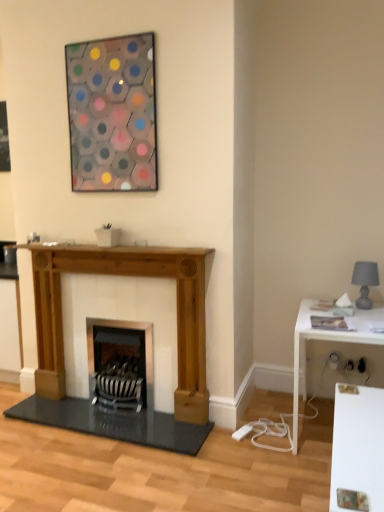
Question: Is metallic hexagonal artwork at upper center facing away from white glossy table at right?

Choices:
 (A) yes
 (B) no

Answer: (B)

Question: Is the position of metallic hexagonal artwork at upper center more distant than that of white glossy table at right?

Choices:
 (A) yes
 (B) no

Answer: (A)

Question: From a real-world perspective, is metallic hexagonal artwork at upper center over white glossy table at right?

Choices:
 (A) no
 (B) yes

Answer: (B)

Question: Is metallic hexagonal artwork at upper center surrounding white glossy table at right?

Choices:
 (A) no
 (B) yes

Answer: (A)

Question: From the image's perspective, does metallic hexagonal artwork at upper center appear higher than white glossy table at right?

Choices:
 (A) no
 (B) yes

Answer: (B)

Question: From the image's perspective, relative to white glossy table at right, is metallic hexagonal artwork at upper center above or below?

Choices:
 (A) below
 (B) above

Answer: (B)

Question: Is metallic hexagonal artwork at upper center to the left or to the right of white glossy table at right in the image?

Choices:
 (A) right
 (B) left

Answer: (B)

Question: Considering the positions of metallic hexagonal artwork at upper center and white glossy table at right in the image, is metallic hexagonal artwork at upper center wider or thinner than white glossy table at right?

Choices:
 (A) wide
 (B) thin

Answer: (B)

Question: In terms of size, does metallic hexagonal artwork at upper center appear bigger or smaller than white glossy table at right?

Choices:
 (A) small
 (B) big

Answer: (A)

Question: Is white glossy table at right bigger or smaller than natural wood fireplace at center?

Choices:
 (A) small
 (B) big

Answer: (A)

Question: In the image, is white glossy table at right positioned in front of or behind natural wood fireplace at center?

Choices:
 (A) front
 (B) behind

Answer: (A)

Question: From a real-world perspective, relative to natural wood fireplace at center, is white glossy table at right vertically above or below?

Choices:
 (A) above
 (B) below

Answer: (B)

Question: Considering the positions of white glossy table at right and natural wood fireplace at center in the image, is white glossy table at right wider or thinner than natural wood fireplace at center?

Choices:
 (A) thin
 (B) wide

Answer: (B)

Question: In terms of width, does black metal wood burning stove at center look wider or thinner when compared to white glossy table at right?

Choices:
 (A) thin
 (B) wide

Answer: (A)

Question: From the image's perspective, is black metal wood burning stove at center above or below white glossy table at right?

Choices:
 (A) above
 (B) below

Answer: (B)